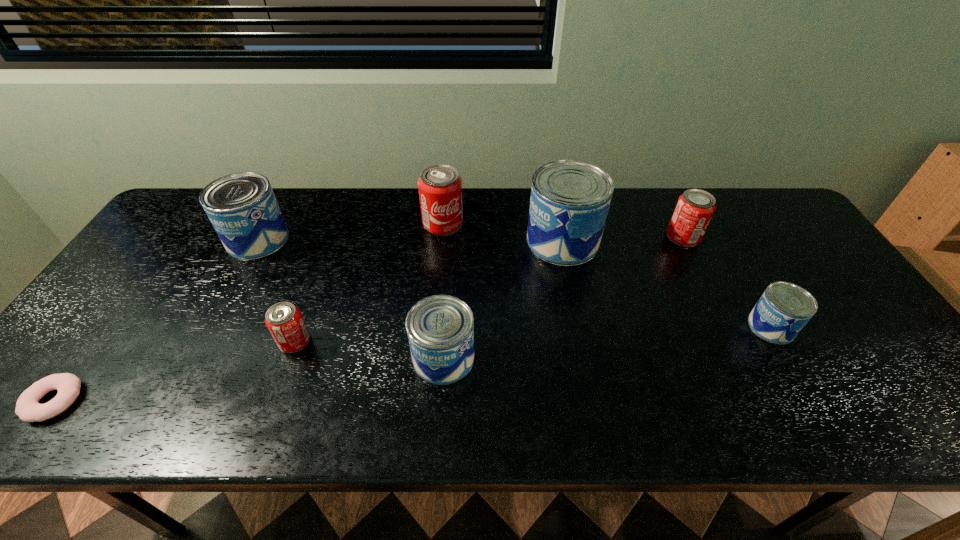
Find the location of `the rightmost blue can`. the rightmost blue can is located at coordinates (784, 308).

Where is `the rightmost can`? The height and width of the screenshot is (540, 960). the rightmost can is located at coordinates (784, 308).

What are the coordinates of `the shortest object` in the screenshot? It's located at (28, 409).

Image resolution: width=960 pixels, height=540 pixels. Identify the location of the leftmost object. (28, 409).

This screenshot has height=540, width=960. Identify the location of vacant space situated on the front label of the biggest blue can. (412, 241).

The width and height of the screenshot is (960, 540). I want to click on vacant position located 0.070m on the front label of the biggest blue can, so click(503, 241).

What are the coordinates of `vacant space located on the front label of the biggest blue can` in the screenshot? It's located at (479, 241).

In order to click on vacant space located 0.090m on the front of the biggest red can in this screenshot , I will do `click(440, 258)`.

Image resolution: width=960 pixels, height=540 pixels. I want to click on vacant point located on the front label of the second biggest blue can, so click(x=398, y=239).

Identify the location of vacant area situated on the front of the second object from right to left. This screenshot has height=540, width=960. tap(700, 273).